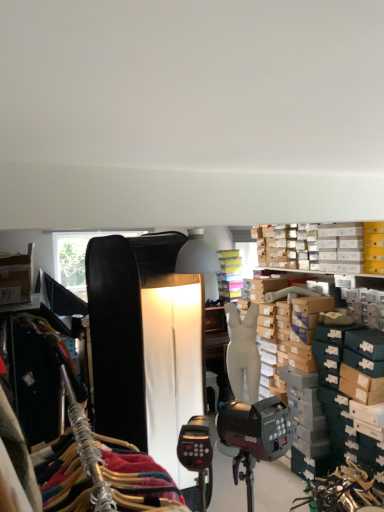
Question: From the image's perspective, would you say white cardboard boxes at upper right is shown under white matte mannequin at center?

Choices:
 (A) yes
 (B) no

Answer: (B)

Question: Is white cardboard boxes at upper right closer to camera compared to white matte mannequin at center?

Choices:
 (A) no
 (B) yes

Answer: (B)

Question: From a real-world perspective, is white cardboard boxes at upper right positioned over white matte mannequin at center based on gravity?

Choices:
 (A) yes
 (B) no

Answer: (A)

Question: Could white matte mannequin at center be considered to be inside white cardboard boxes at upper right?

Choices:
 (A) yes
 (B) no

Answer: (B)

Question: Is white cardboard boxes at upper right wider than white matte mannequin at center?

Choices:
 (A) yes
 (B) no

Answer: (A)

Question: Are white cardboard boxes at upper right and white matte mannequin at center far apart?

Choices:
 (A) yes
 (B) no

Answer: (A)

Question: Does white matte mannequin at center have a larger size compared to white cardboard boxes at upper right?

Choices:
 (A) yes
 (B) no

Answer: (A)

Question: Can you confirm if white matte mannequin at center is wider than white cardboard boxes at upper right?

Choices:
 (A) yes
 (B) no

Answer: (B)

Question: Is the surface of white matte mannequin at center in direct contact with white cardboard boxes at upper right?

Choices:
 (A) yes
 (B) no

Answer: (B)

Question: Does white matte mannequin at center lie in front of white cardboard boxes at upper right?

Choices:
 (A) yes
 (B) no

Answer: (B)

Question: From the image's perspective, is white matte mannequin at center under white cardboard boxes at upper right?

Choices:
 (A) no
 (B) yes

Answer: (B)

Question: Is white matte mannequin at center outside white cardboard boxes at upper right?

Choices:
 (A) yes
 (B) no

Answer: (A)

Question: In terms of height, does white cardboard boxes at upper right look taller or shorter compared to white matte mannequin at center?

Choices:
 (A) short
 (B) tall

Answer: (A)